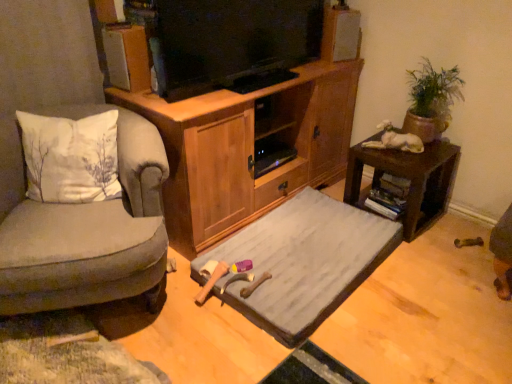
Question: Is wooden cabinet at center wider than velvet grey armchair at left?

Choices:
 (A) no
 (B) yes

Answer: (B)

Question: Does wooden cabinet at center lie behind velvet grey armchair at left?

Choices:
 (A) no
 (B) yes

Answer: (B)

Question: Can you confirm if wooden cabinet at center is bigger than velvet grey armchair at left?

Choices:
 (A) yes
 (B) no

Answer: (A)

Question: From a real-world perspective, is wooden cabinet at center on velvet grey armchair at left?

Choices:
 (A) no
 (B) yes

Answer: (B)

Question: From the image's perspective, would you say wooden cabinet at center is positioned over velvet grey armchair at left?

Choices:
 (A) yes
 (B) no

Answer: (A)

Question: Considering the relative positions of wooden cabinet at center and velvet grey armchair at left in the image provided, is wooden cabinet at center to the left of velvet grey armchair at left from the viewer's perspective?

Choices:
 (A) no
 (B) yes

Answer: (A)

Question: Does green clay pot at upper right have a greater width compared to white cotton pillow at left?

Choices:
 (A) yes
 (B) no

Answer: (B)

Question: Would you say white cotton pillow at left is part of green clay pot at upper right's contents?

Choices:
 (A) yes
 (B) no

Answer: (B)

Question: From the image's perspective, is green clay pot at upper right on white cotton pillow at left?

Choices:
 (A) no
 (B) yes

Answer: (B)

Question: Is green clay pot at upper right oriented away from white cotton pillow at left?

Choices:
 (A) yes
 (B) no

Answer: (B)

Question: Is the surface of green clay pot at upper right in direct contact with white cotton pillow at left?

Choices:
 (A) no
 (B) yes

Answer: (A)

Question: From the image's perspective, is green clay pot at upper right beneath white cotton pillow at left?

Choices:
 (A) yes
 (B) no

Answer: (B)

Question: Considering the relative positions of white cotton pillow at left and velvet grey armchair at left in the image provided, is white cotton pillow at left to the right of velvet grey armchair at left from the viewer's perspective?

Choices:
 (A) no
 (B) yes

Answer: (B)